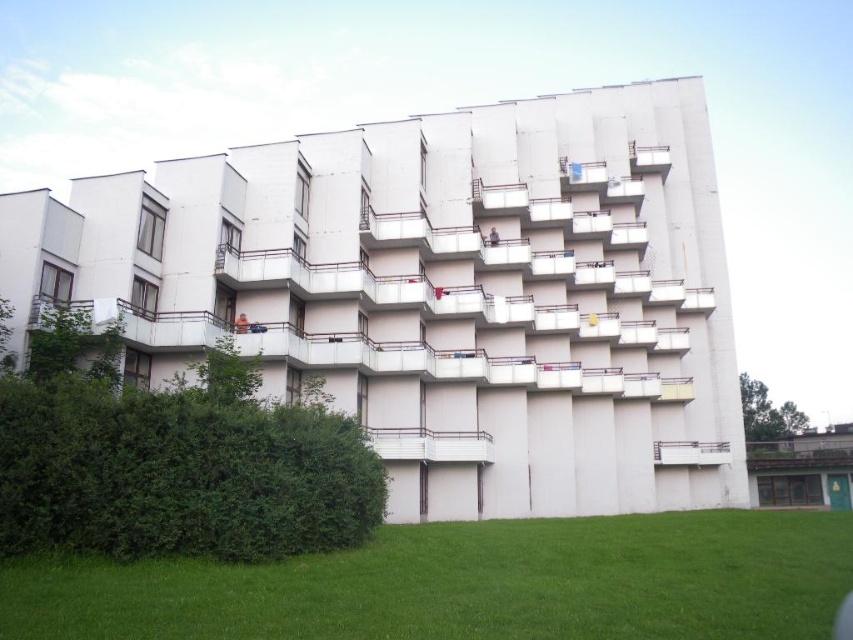
Question: Which object is farther from the camera taking this photo?

Choices:
 (A) white concrete balcony at center
 (B) green grass at lower center

Answer: (A)

Question: Which object is the farthest from the green leafy hedge at left?

Choices:
 (A) green grass at lower center
 (B) white concrete balcony at center
 (C) white metal balcony at center

Answer: (B)

Question: Is white metal balcony at center to the left of white concrete balcony at center from the viewer's perspective?

Choices:
 (A) yes
 (B) no

Answer: (A)

Question: Can you confirm if white metal balcony at center is positioned to the left of white concrete balcony at center?

Choices:
 (A) yes
 (B) no

Answer: (A)

Question: Which object appears closest to the camera in this image?

Choices:
 (A) white concrete balcony at center
 (B) green leafy hedge at left
 (C) white metal balcony at center
 (D) green grass at lower center

Answer: (D)

Question: Does green grass at lower center have a smaller size compared to green leafy hedge at left?

Choices:
 (A) no
 (B) yes

Answer: (A)